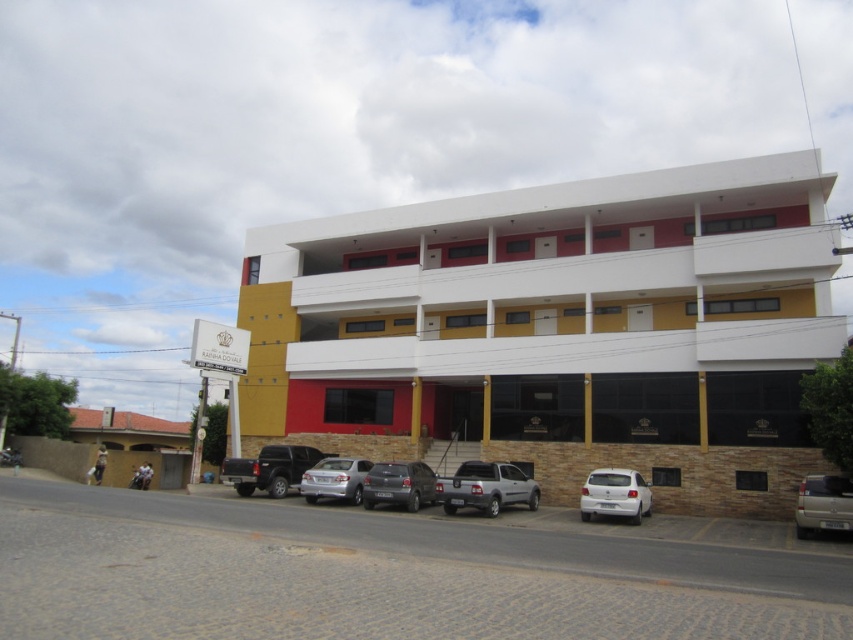
Between satin silver pickup truck at center and matte black truck at center, which one has more height?

With more height is matte black truck at center.

Can you confirm if satin silver pickup truck at center is positioned above matte black truck at center?

Yes.

Measure the distance between point [462,464] and camera.

Point [462,464] and camera are 98.56 feet apart from each other.

Identify the location of satin silver pickup truck at center. (486, 486).

Can you confirm if yellow brick building at center is positioned above satin silver car at center?

Correct, yellow brick building at center is located above satin silver car at center.

Does yellow brick building at center have a greater height compared to satin silver car at center?

Yes.

Locate an element on the screen. yellow brick building at center is located at coordinates (560, 328).

What do you see at coordinates (560, 328) in the screenshot?
I see `yellow brick building at center` at bounding box center [560, 328].

Who is more forward, (727, 317) or (614, 477)?

Point (614, 477)

In order to click on yellow brick building at center in this screenshot , I will do `click(560, 328)`.